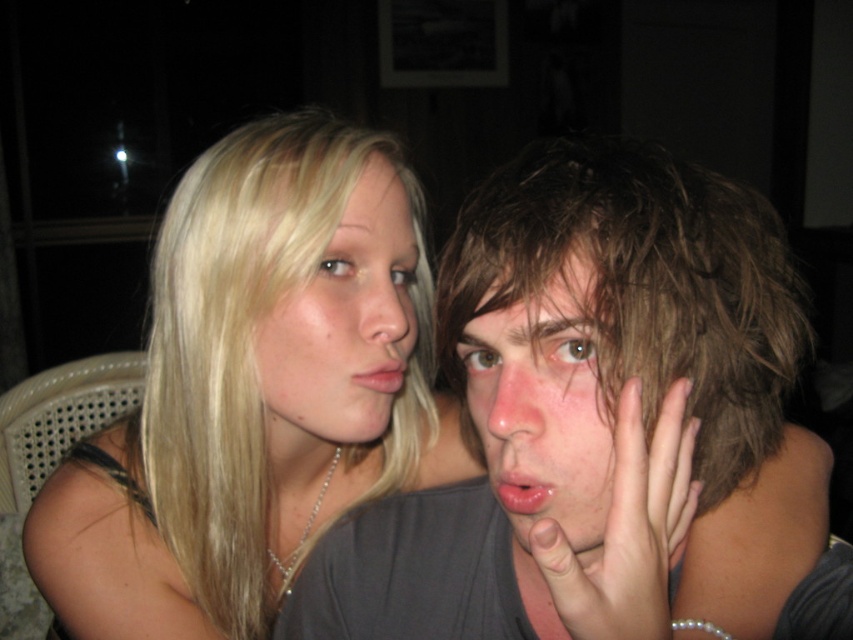
You are a photographer trying to capture a candid shot of the two people in the scene. Since you want to ensure both subjects are fully visible in the frame, can you determine if there is enough space between the blonde hair at left and the dry skin face at right to fit a third person standing between them?

The blonde hair at left is positioned on the left side of dry skin face at right, but the description does not provide specific measurements of the distance between them. Without knowing the exact space between the two, it is impossible to determine if a third person can fit between them.

You are a photographer trying to capture a candid shot of two friends at a party. You notice the blonde hair at left and the dry skin face at right. Can you tell me which one is covering the other in the image?

The blonde hair at left is positioned over dry skin face at right, so it is covering the other object.